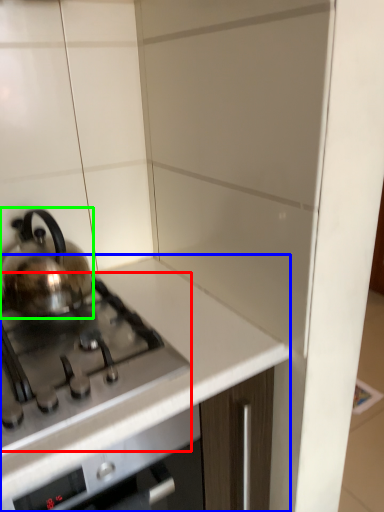
Question: Considering the real-world distances, which object is closest to gas stove (highlighted by a red box)? countertop (highlighted by a blue box) or kettle (highlighted by a green box).

Choices:
 (A) countertop
 (B) kettle

Answer: (A)